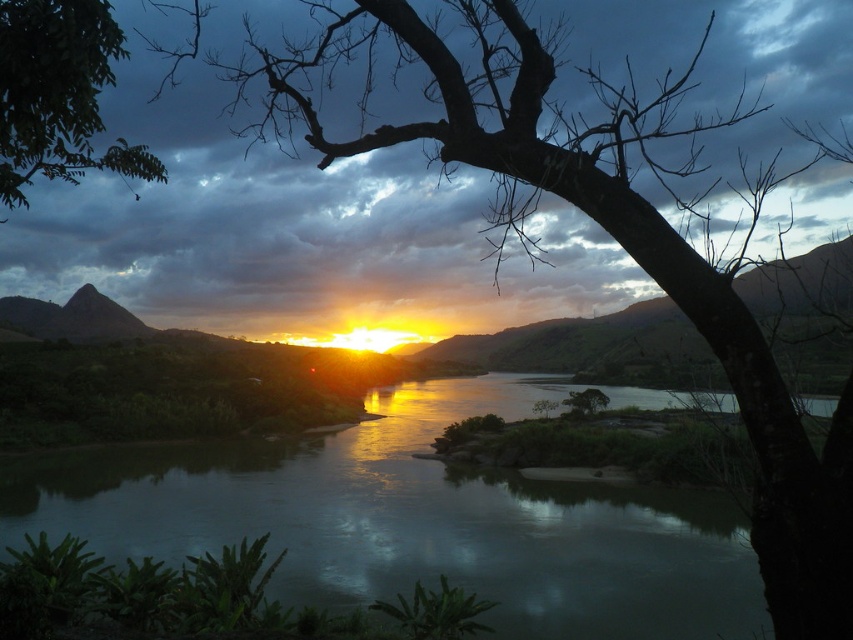
Question: Does green reflective water at center appear under green leafy tree at upper left?

Choices:
 (A) yes
 (B) no

Answer: (A)

Question: Is green reflective water at center smaller than green leafy tree at upper left?

Choices:
 (A) yes
 (B) no

Answer: (B)

Question: Which point appears farthest from the camera in this image?

Choices:
 (A) (364, 547)
 (B) (39, 22)

Answer: (A)

Question: Can you confirm if green reflective water at center is positioned to the left of green leafy tree at upper left?

Choices:
 (A) no
 (B) yes

Answer: (A)

Question: Which point is closer to the camera taking this photo?

Choices:
 (A) (67, 35)
 (B) (730, 515)

Answer: (A)